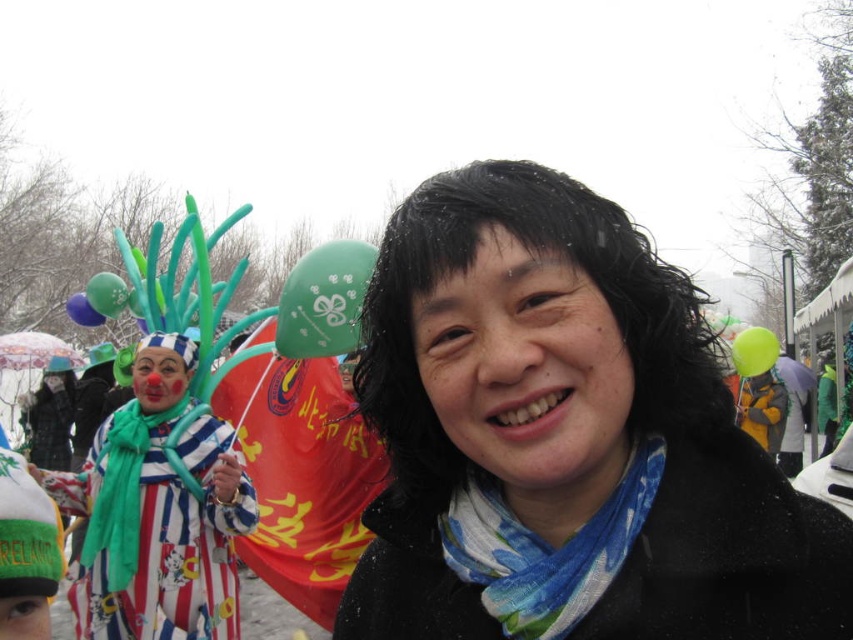
You are at a festival and see two green balloons. One is a green matte balloon at upper center and the other is a green rubber balloon at right. Which balloon is positioned higher in the sky?

The green matte balloon at upper center is positioned higher in the sky than the green rubber balloon at right.

You are at a party and want to give a child a balloon. The green rubber balloon at right is smaller than the matte blue balloon at upper left. Which balloon should you choose if you want the smaller one?

You should choose the green rubber balloon at right because it has a smaller size compared to the matte blue balloon at upper left.

Based on the coordinates provided in the scene description, where is the green rubber balloon at right located?

The green rubber balloon at right is located at point [753,349].